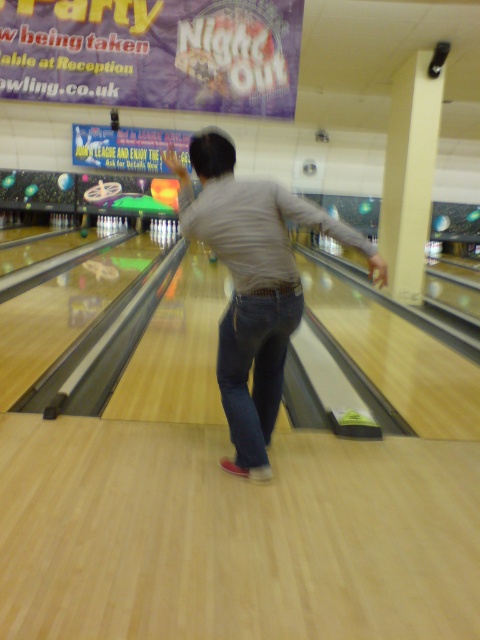
Question: Is denim jeans at center positioned before dark blue denim jeans at center?

Choices:
 (A) no
 (B) yes

Answer: (B)

Question: Which point is farther to the camera?

Choices:
 (A) (274, 301)
 (B) (254, 340)

Answer: (B)

Question: Which object is farther from the camera taking this photo?

Choices:
 (A) dark blue denim jeans at center
 (B) denim jeans at center

Answer: (A)

Question: Is denim jeans at center bigger than dark blue denim jeans at center?

Choices:
 (A) yes
 (B) no

Answer: (A)

Question: Can you confirm if denim jeans at center is positioned to the right of dark blue denim jeans at center?

Choices:
 (A) no
 (B) yes

Answer: (B)

Question: Which point is closer to the camera?

Choices:
 (A) (239, 403)
 (B) (272, 186)

Answer: (B)